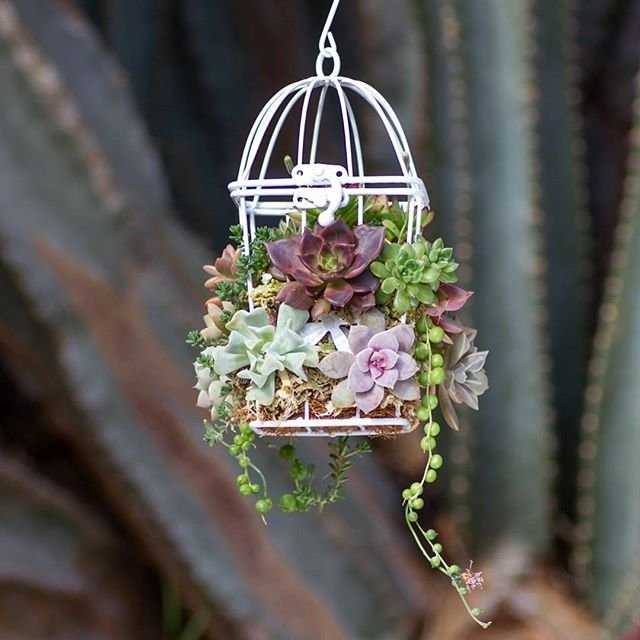
You are a GUI agent. You are given a task and a screenshot of the screen. Output one action in this format:
    pyautogui.click(x=<x>, y=<y>)
    Task: Click on the hook
    This screenshot has width=640, height=640.
    Given the screenshot: What is the action you would take?
    pyautogui.click(x=330, y=44)